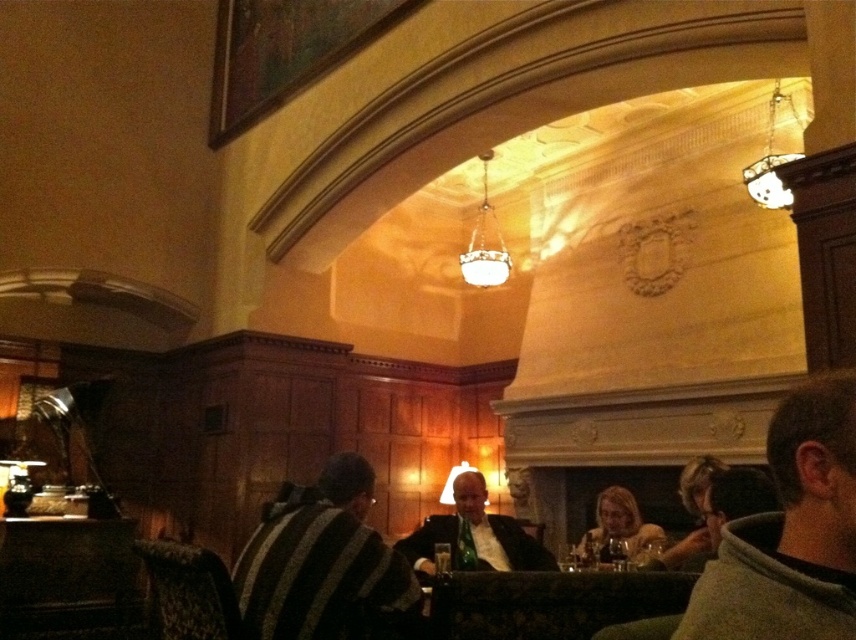
You are a guest at this event and want to take a photo of the striped sweater at center and the white glass chandelier at center. Which object will appear larger in your photo?

The white glass chandelier at center will appear larger in the photo because it is bigger than the striped sweater at center.

You are a guest at this event and want to place a small decorative item on the table between the striped sweater at center and the white glass chandelier at center. Which object should you place it closer to if you want it to be centered between them?

You should place the decorative item closer to the white glass chandelier at center because the striped sweater at center is wider, so the center point between them would be nearer to the narrower object.

You are a server in this dining area and need to deliver a tray of drinks to the table. The tray is 2 meters long. Can you safely carry the tray between the striped sweater at center and the light brown leather jacket at center without hitting either?

The distance between the striped sweater at center and the light brown leather jacket at center is 1.96 meters. Since the tray is 2 meters long, it is slightly longer than the space available. Therefore, you cannot safely carry the tray between them without risking a collision.